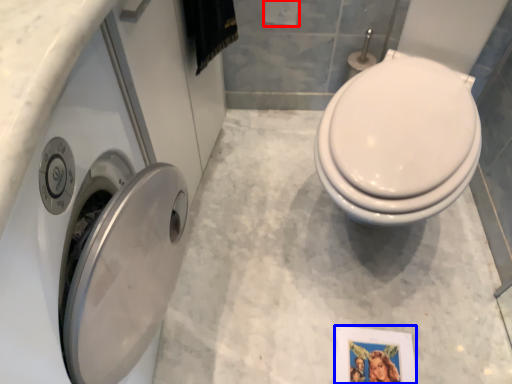
Question: Which point is closer to the camera, toilet paper (highlighted by a red box) or picture frame (highlighted by a blue box)?

Choices:
 (A) toilet paper
 (B) picture frame

Answer: (A)